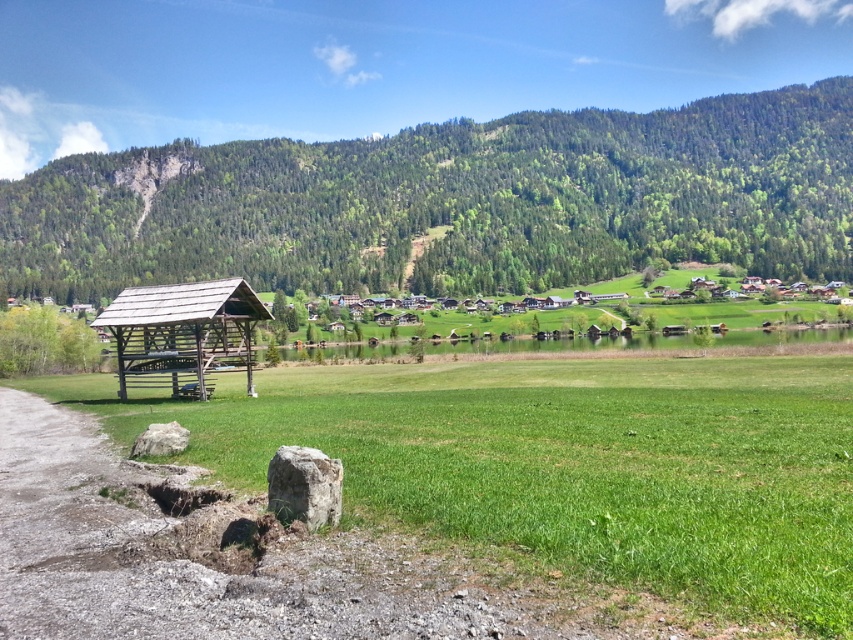
You are a gardener who wants to plant a row of sunflowers in the green grassy field at center. Considering the height of the wooden shed at left, will the sunflowers be visible from the shed when they grow to their full height of 1.5 meters?

The green grassy field at center is shorter than the wooden shed at left, so when the sunflowers grow to 1.5 meters, they will be taller than the grass but still shorter than the shed. Therefore, they might not be fully visible from the shed unless they grow taller than the shed itself.

You are standing in the green grassy field at center and want to walk to the wooden shed at left. Which direction should you face to move towards it?

You should face the wooden shed at left, which is behind the green grassy field at center. Since the green grassy field at center is in front of the wooden shed at left, the shed is located behind the field from your current position.

Looking at the scene, which object occupies more space in the image? The green forested mountain at upper center or the green grassy field at center?

The green forested mountain at upper center is bigger than the green grassy field at center, so it occupies more space in the image.